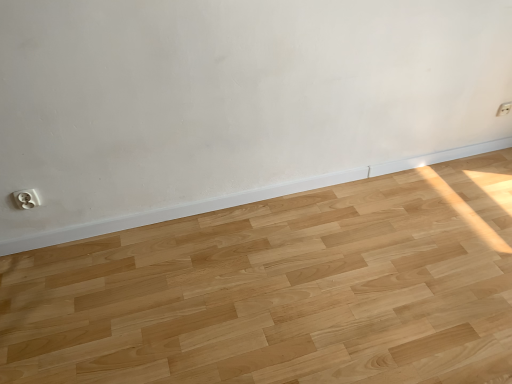
Question: Can you confirm if white plastic electric outlet at upper right, arranged as the 2th electric outlet when viewed from the front, is smaller than white plastic electric outlet at lower left, the first electric outlet viewed from the left?

Choices:
 (A) no
 (B) yes

Answer: (B)

Question: Is white plastic electric outlet at upper right, arranged as the 2th electric outlet when viewed from the front, thinner than white plastic electric outlet at lower left, which is counted as the 1th electric outlet, starting from the bottom?

Choices:
 (A) no
 (B) yes

Answer: (B)

Question: Can you confirm if white plastic electric outlet at upper right, acting as the 1th electric outlet starting from the back, is bigger than white plastic electric outlet at lower left, which appears as the 1th electric outlet when viewed from the front?

Choices:
 (A) yes
 (B) no

Answer: (B)

Question: From the image's perspective, is white plastic electric outlet at upper right, acting as the 1th electric outlet starting from the back, over white plastic electric outlet at lower left, acting as the 2th electric outlet starting from the top?

Choices:
 (A) yes
 (B) no

Answer: (A)

Question: Is white plastic electric outlet at upper right, positioned as the 1th electric outlet in right-to-left order, positioned in front of white plastic electric outlet at lower left, the first electric outlet viewed from the left?

Choices:
 (A) no
 (B) yes

Answer: (A)

Question: Is white plastic electric outlet at upper right, placed as the 2th electric outlet when sorted from left to right, at the left side of white plastic electric outlet at lower left, the first electric outlet viewed from the left?

Choices:
 (A) no
 (B) yes

Answer: (A)

Question: Is white plastic electric outlet at lower left, which is the 2th electric outlet from back to front, smaller than white plastic electric outlet at upper right, which ranks as the first electric outlet in top-to-bottom order?

Choices:
 (A) yes
 (B) no

Answer: (B)

Question: From the image's perspective, does white plastic electric outlet at lower left, which appears as the 1th electric outlet when viewed from the front, appear higher than white plastic electric outlet at upper right, positioned as the 1th electric outlet in right-to-left order?

Choices:
 (A) no
 (B) yes

Answer: (A)

Question: Is white plastic electric outlet at lower left, which is the 2th electric outlet from back to front, further to the viewer compared to white plastic electric outlet at upper right, acting as the 1th electric outlet starting from the back?

Choices:
 (A) no
 (B) yes

Answer: (A)

Question: Is white plastic electric outlet at lower left, which appears as the 1th electric outlet when viewed from the front, closer to the viewer compared to white plastic electric outlet at upper right, placed as the 2th electric outlet when sorted from left to right?

Choices:
 (A) yes
 (B) no

Answer: (A)

Question: Considering the relative positions of white plastic electric outlet at lower left, acting as the 2th electric outlet starting from the top, and white plastic electric outlet at upper right, which ranks as the first electric outlet in top-to-bottom order, in the image provided, is white plastic electric outlet at lower left, acting as the 2th electric outlet starting from the top, to the right of white plastic electric outlet at upper right, which ranks as the first electric outlet in top-to-bottom order, from the viewer's perspective?

Choices:
 (A) no
 (B) yes

Answer: (A)

Question: Is white plastic electric outlet at lower left, acting as the 2th electric outlet starting from the top, beside white plastic electric outlet at upper right, positioned as the 1th electric outlet in right-to-left order?

Choices:
 (A) no
 (B) yes

Answer: (A)

Question: From the image's perspective, is white plastic electric outlet at upper right, arranged as the 2th electric outlet when viewed from the front, located above or below white plastic electric outlet at lower left, which appears as the 1th electric outlet when viewed from the front?

Choices:
 (A) above
 (B) below

Answer: (A)